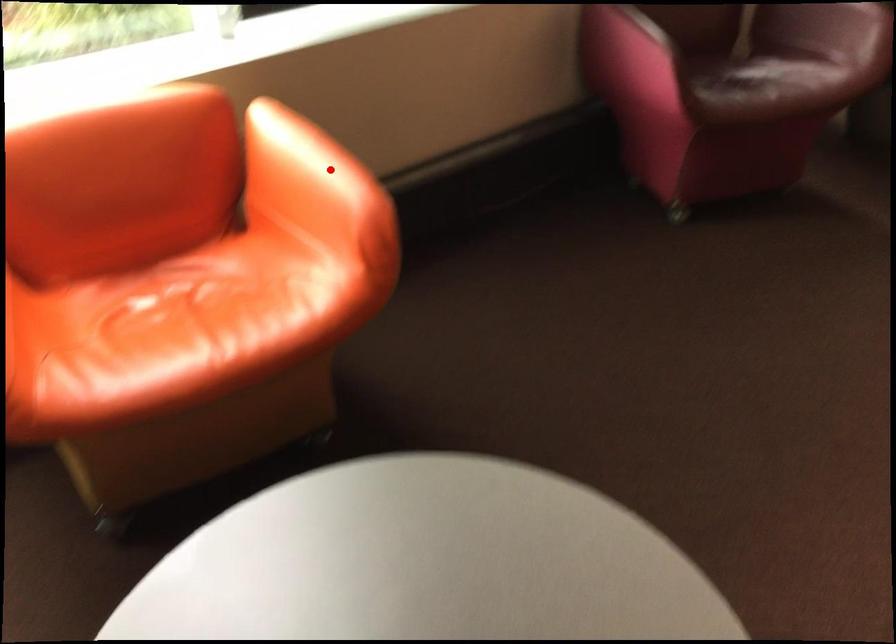
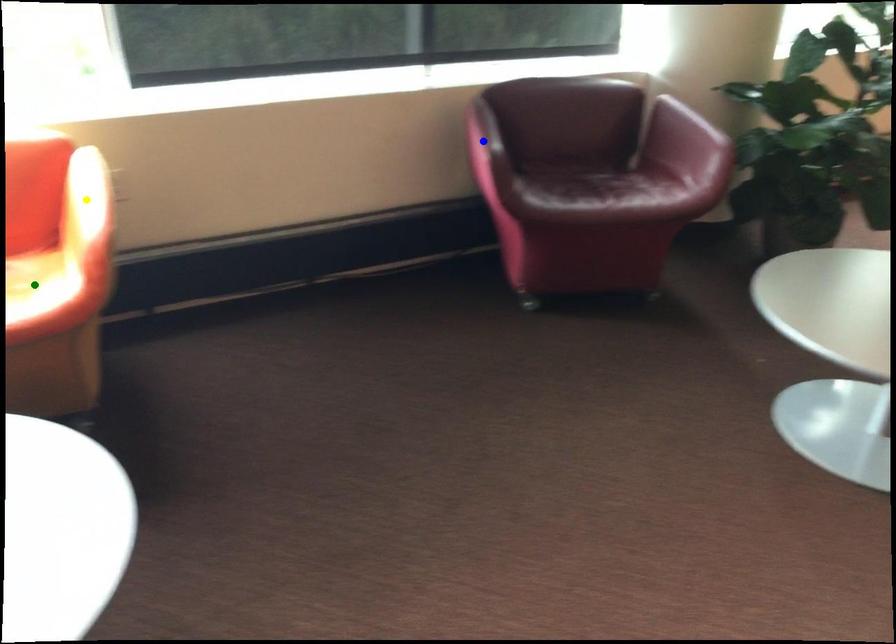
Question: I am providing you with two images of the same scene from different viewpoints. A red point is marked on the first image. You are given multiple points on the second image. In image 2, which mark is for the same physical point as the one in image 1?

Choices:
 (A) blue point
 (B) yellow point
 (C) green point

Answer: (B)